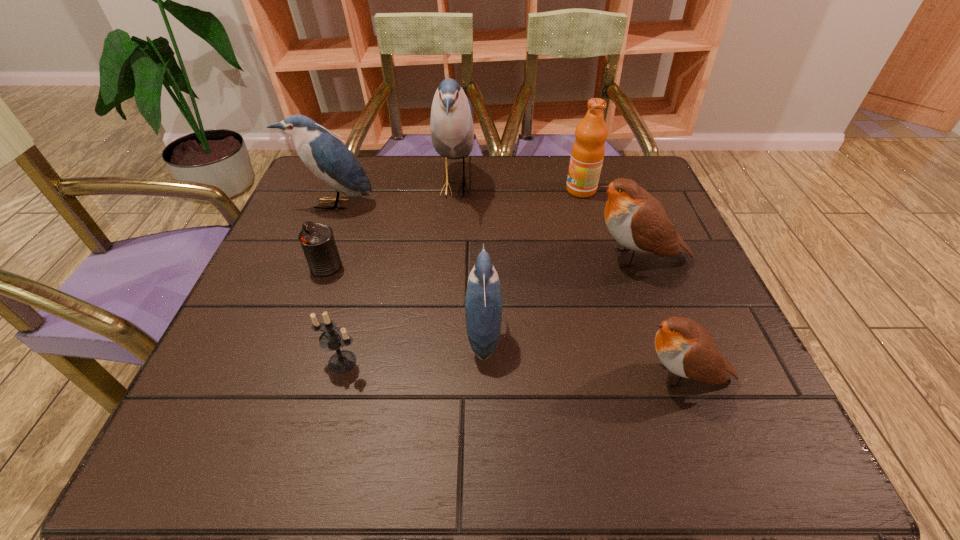
You are a GUI agent. You are given a task and a screenshot of the screen. Output one action in this format:
    pyautogui.click(x=<x>, y=<y>)
    Task: Click on the can that is positioned at the left edge
    Image resolution: width=960 pixels, height=540 pixels.
    Given the screenshot: What is the action you would take?
    pyautogui.click(x=317, y=240)

Locate an element on the screen. This screenshot has height=540, width=960. object that is at the far left corner is located at coordinates (327, 157).

The height and width of the screenshot is (540, 960). In the image, there is a desktop. What are the coordinates of `vacant area at the far edge` in the screenshot? It's located at (468, 195).

This screenshot has width=960, height=540. In order to click on blank space at the near edge in this screenshot , I will do `click(442, 427)`.

Where is `free space at the left edge of the desktop`? This screenshot has height=540, width=960. free space at the left edge of the desktop is located at coordinates (274, 309).

Where is `free location at the right edge of the desktop`? free location at the right edge of the desktop is located at coordinates (671, 384).

In the image, there is a desktop. At what (x,y) coordinates should I click in order to perform the action: click on blank space at the near right corner. Please return your answer as a coordinate pair (x, y). Looking at the image, I should click on (781, 445).

Where is `free space between the biggest blue bird and the candle holder`? The height and width of the screenshot is (540, 960). free space between the biggest blue bird and the candle holder is located at coordinates (398, 274).

Identify the location of vacant area that lies between the leftmost blue bird and the bigger brown bird. The height and width of the screenshot is (540, 960). (486, 231).

You are a GUI agent. You are given a task and a screenshot of the screen. Output one action in this format:
    pyautogui.click(x=<x>, y=<y>)
    Task: Click on the free spot between the nearer brown bird and the bigger brown bird
    The height and width of the screenshot is (540, 960).
    Given the screenshot: What is the action you would take?
    pyautogui.click(x=660, y=317)